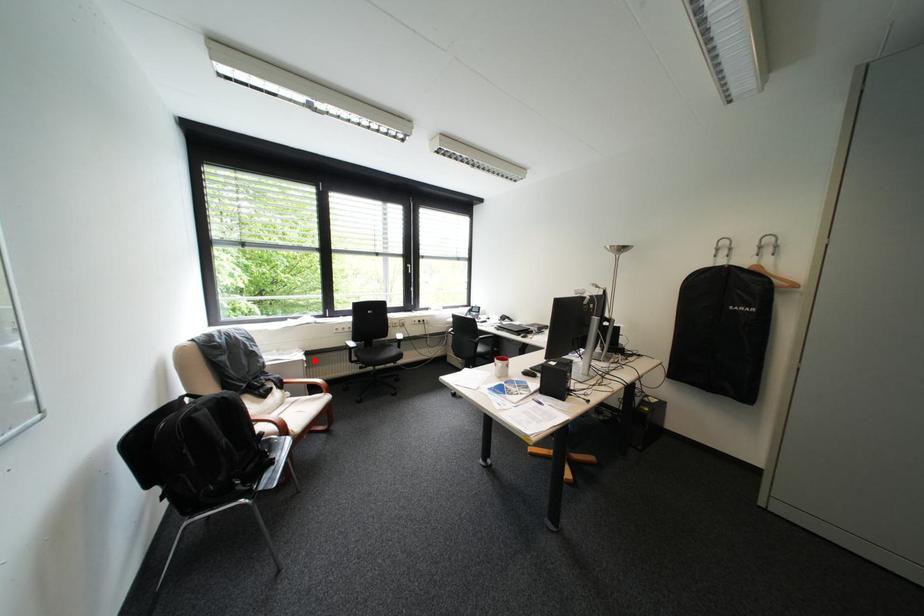
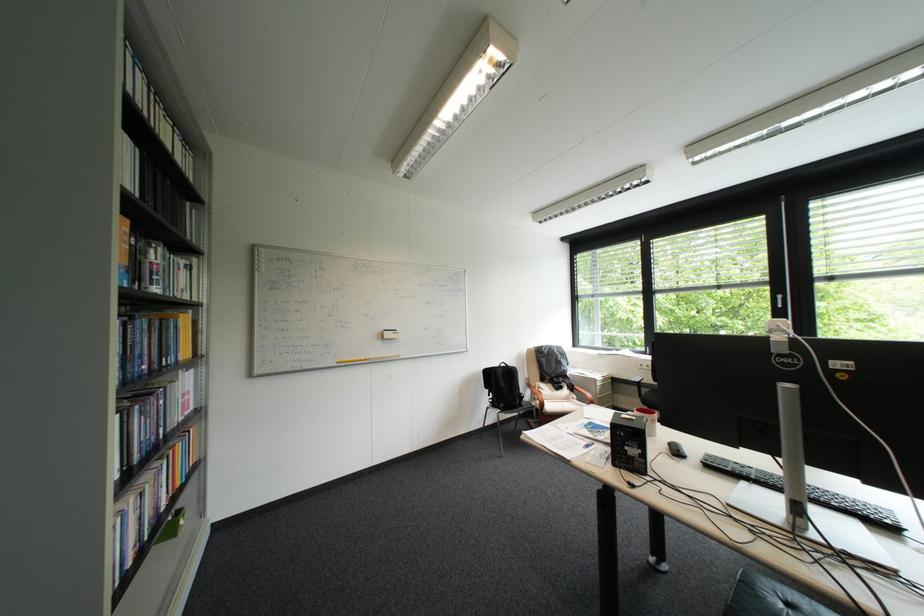
Where in the second image is the point corresponding to the highlighted location from the first image?

(608, 379)